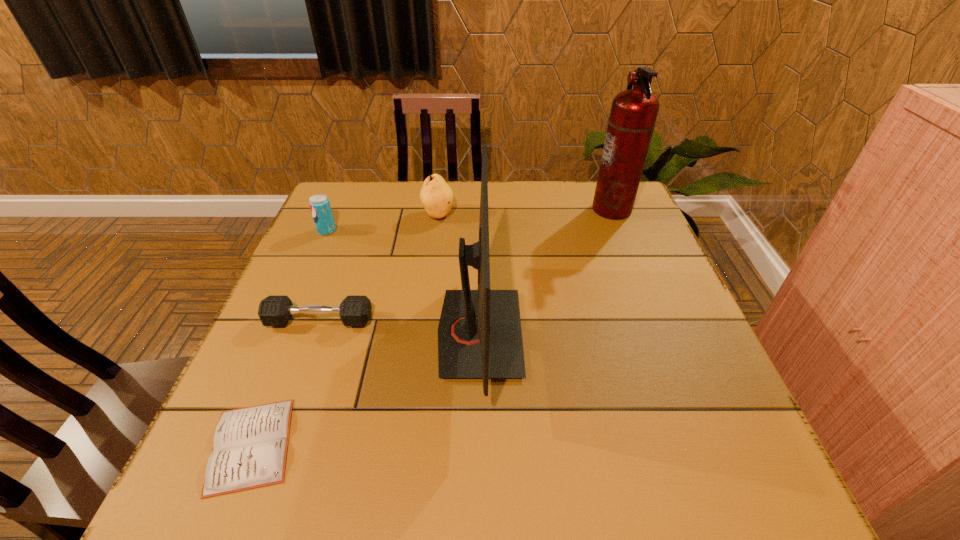
Identify the location of free space that is in between the monitor and the third tallest object. This screenshot has width=960, height=540. (459, 274).

Where is `unoccupied area between the shortest object and the fire extinguisher`? unoccupied area between the shortest object and the fire extinguisher is located at coordinates (431, 327).

Identify the location of free spot between the third farthest object and the monitor. The width and height of the screenshot is (960, 540). (403, 282).

Locate an element on the screen. The width and height of the screenshot is (960, 540). vacant area that lies between the fifth shortest object and the shortest object is located at coordinates (366, 389).

Where is `free point between the fifth tallest object and the pear`? This screenshot has width=960, height=540. free point between the fifth tallest object and the pear is located at coordinates (378, 268).

The height and width of the screenshot is (540, 960). I want to click on free space that is in between the tallest object and the diary, so click(x=431, y=327).

At what (x,y) coordinates should I click in order to perform the action: click on unoccupied area between the shortest object and the second tallest object. Please return your answer as a coordinate pair (x, y). The height and width of the screenshot is (540, 960). Looking at the image, I should click on (366, 389).

Locate which object ranks fourth in proximity to the monitor. Please provide its 2D coordinates. Your answer should be formatted as a tuple, i.e. [(x, y)], where the tuple contains the x and y coordinates of a point satisfying the conditions above.

[(633, 114)]

Identify which object is located as the fourth nearest to the soda can. Please provide its 2D coordinates. Your answer should be formatted as a tuple, i.e. [(x, y)], where the tuple contains the x and y coordinates of a point satisfying the conditions above.

[(250, 446)]

This screenshot has width=960, height=540. Find the location of `free space that satisfies the following two spatial constraints: 1. on the screen side of the second tallest object; 2. on the front side of the diary`. free space that satisfies the following two spatial constraints: 1. on the screen side of the second tallest object; 2. on the front side of the diary is located at coordinates (479, 445).